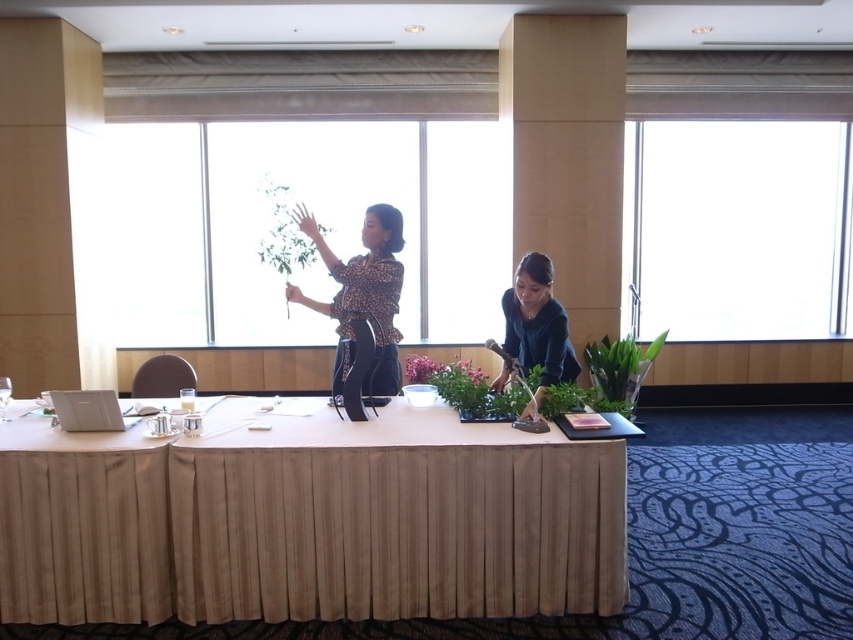
Can you confirm if beige fabric table at center is shorter than green leafy plant at lower right?

No, beige fabric table at center is not shorter than green leafy plant at lower right.

Who is higher up, beige fabric table at center or green leafy plant at lower right?

green leafy plant at lower right

Is point (397, 563) less distant than point (635, 378)?

Yes, it is.

I want to click on beige fabric table at center, so click(x=308, y=520).

Does blue fabric shirt at lower right have a smaller size compared to green leafy plant at lower right?

Yes.

Is blue fabric shirt at lower right closer to camera compared to green leafy plant at lower right?

Yes, it is.

The image size is (853, 640). I want to click on blue fabric shirt at lower right, so click(537, 324).

Does leopard print blouse at center appear on the right side of white matte laptop at lower left?

Indeed, leopard print blouse at center is positioned on the right side of white matte laptop at lower left.

How distant is leopard print blouse at center from white matte laptop at lower left?

They are 95.79 centimeters apart.

At what (x,y) coordinates should I click in order to perform the action: click on leopard print blouse at center. Please return your answer as a coordinate pair (x, y). The image size is (853, 640). Looking at the image, I should click on (363, 294).

The image size is (853, 640). I want to click on leopard print blouse at center, so click(x=363, y=294).